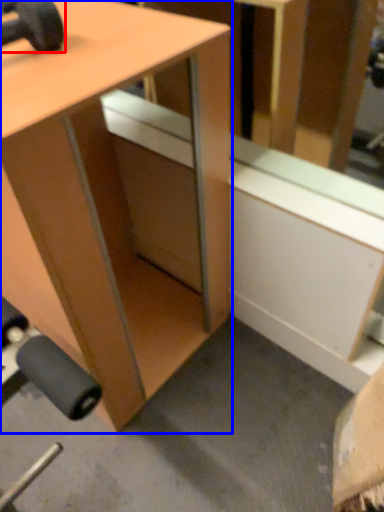
Question: Which of the following is the closest to the observer, dumbbell (highlighted by a red box) or desk (highlighted by a blue box)?

Choices:
 (A) dumbbell
 (B) desk

Answer: (B)